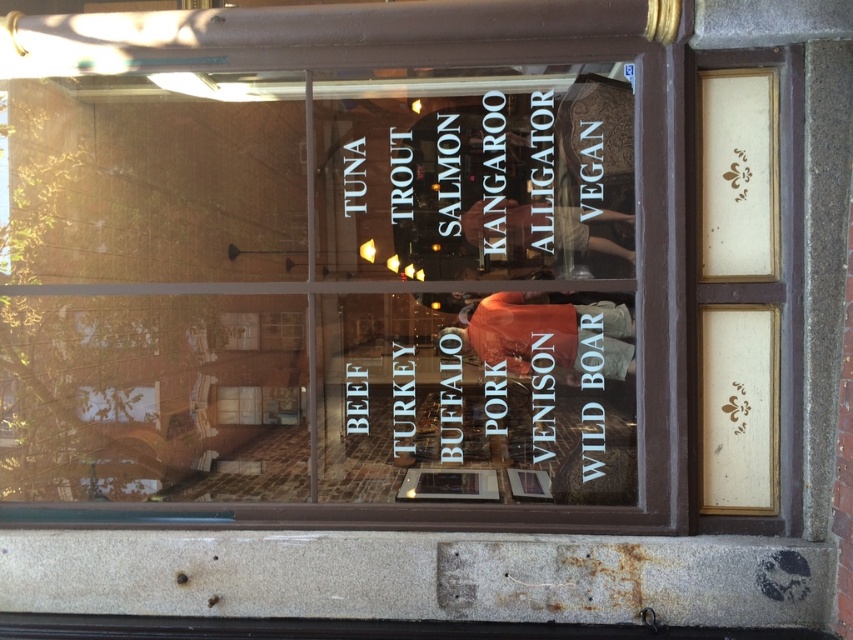
You are a customer looking at the storefront window. You see the transparent glass menu at center and the white paper text at center. Which one is positioned to the left?

The transparent glass menu at center is positioned to the left of the white paper text at center.

You are a customer trying to read the menu in the storefront window. The transparent glass menu at center and the white paper text at center are both part of the display. Which object has a greater width?

The transparent glass menu at center has a greater width than the white paper text at center according to the description.

You are a customer looking at the storefront window. You notice the transparent glass menu at center and the black paper at upper center. Which object is closer to you?

The transparent glass menu at center is closer to you because it is in front of the black paper at upper center.